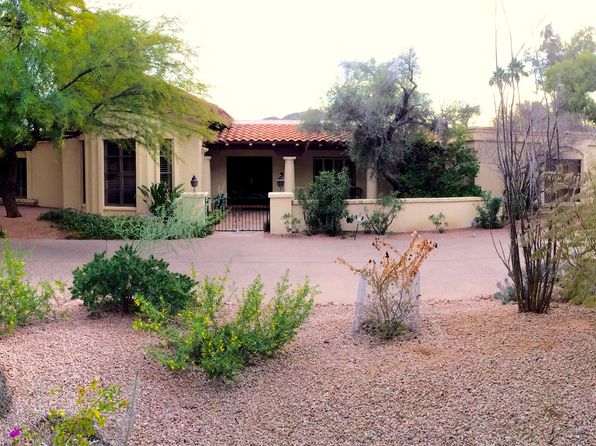
You are a GUI agent. You are given a task and a screenshot of the screen. Output one action in this format:
    pyautogui.click(x=<x>, y=<y>)
    Task: Click on the darkest green plant in the foreground to the left
    
    Given the screenshot: What is the action you would take?
    pyautogui.click(x=131, y=272)